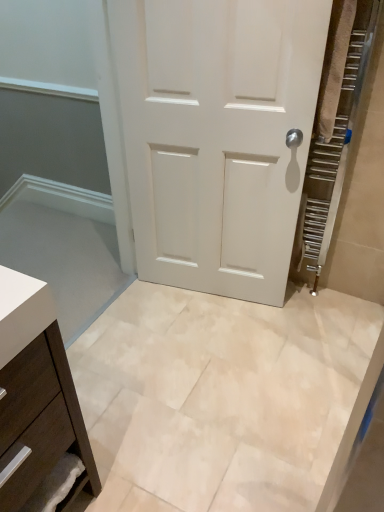
Where is `vacant area in front of white matte door at center`? This screenshot has width=384, height=512. vacant area in front of white matte door at center is located at coordinates (216, 357).